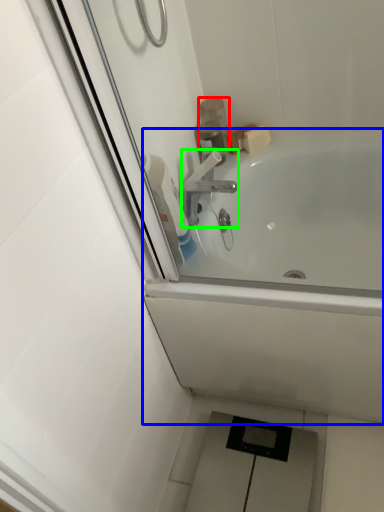
Question: Which object is positioned closest to toiletry (highlighted by a red box)? Select from bathtub (highlighted by a blue box) and tap (highlighted by a green box).

Choices:
 (A) bathtub
 (B) tap

Answer: (B)